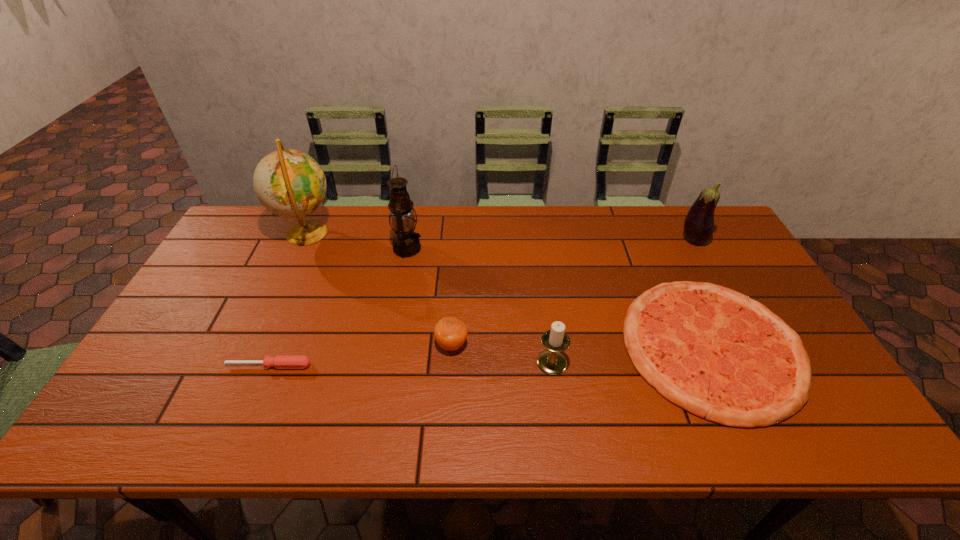
Identify which object is the sixth nearest to the eggplant. Please provide its 2D coordinates. Your answer should be formatted as a tuple, i.e. [(x, y)], where the tuple contains the x and y coordinates of a point satisfying the conditions above.

[(280, 361)]

Locate an element on the screen. This screenshot has width=960, height=540. object identified as the second closest to the fifth shortest object is located at coordinates (551, 361).

I want to click on vacant space that satisfies the following two spatial constraints: 1. on the back side of the eggplant; 2. on the right side of the third object from left to right, so click(409, 239).

This screenshot has width=960, height=540. What are the coordinates of `free spot that satisfies the following two spatial constraints: 1. on the front side of the pizza; 2. on the right side of the globe` in the screenshot? It's located at (254, 347).

Where is `free location that satisfies the following two spatial constraints: 1. on the back side of the third tallest object; 2. on the left side of the screwdriver`? Image resolution: width=960 pixels, height=540 pixels. free location that satisfies the following two spatial constraints: 1. on the back side of the third tallest object; 2. on the left side of the screwdriver is located at coordinates (321, 239).